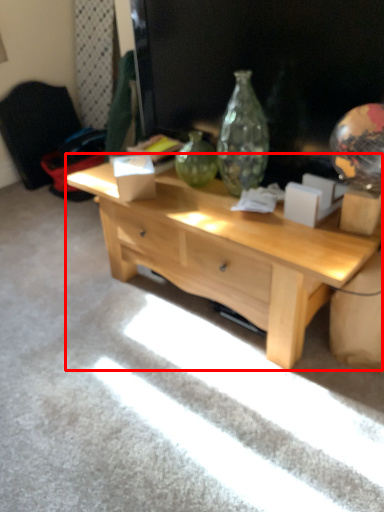
Question: From the image's perspective, what is the correct spatial positioning of desk (annotated by the red box) in reference to armchair?

Choices:
 (A) below
 (B) above

Answer: (A)